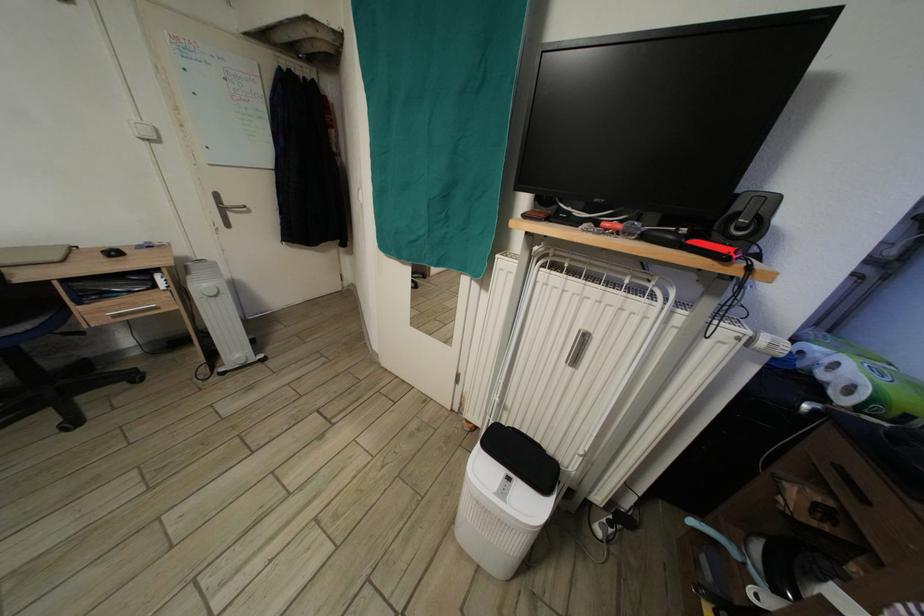
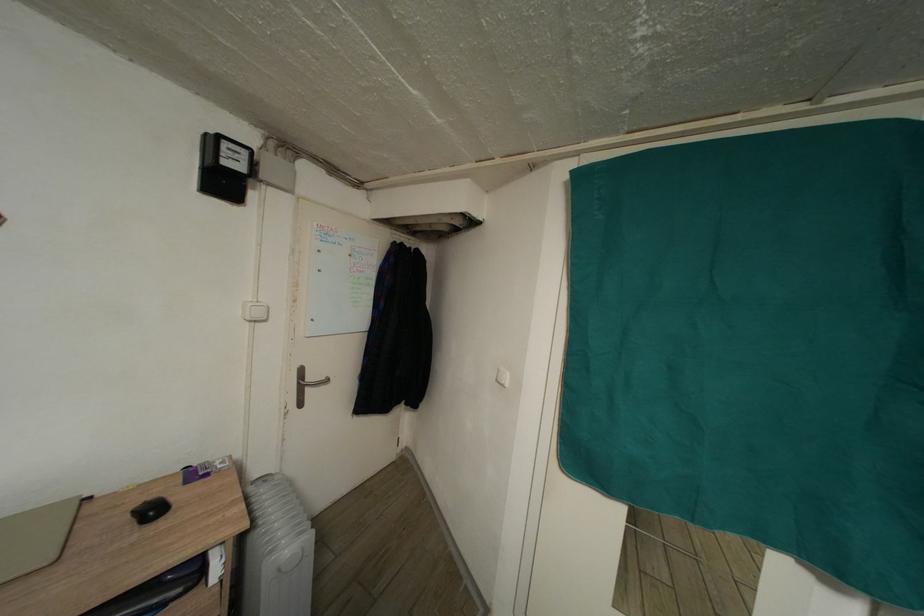
Question: The images are taken continuously from a first-person perspective. In which direction are you moving?

Choices:
 (A) Left
 (B) Right
 (C) Forward
 (D) Backward

Answer: (A)